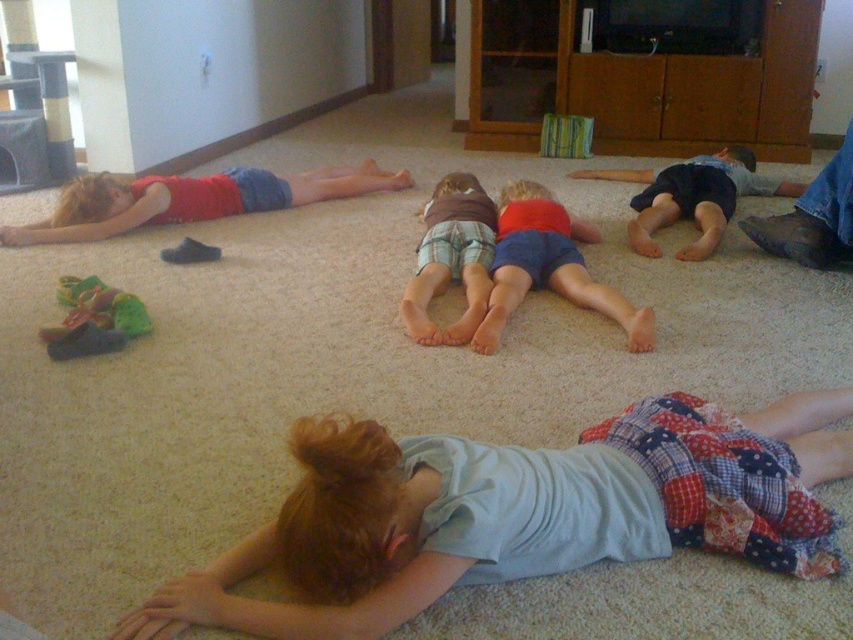
You are a child looking for your shorts. You see the red cotton shorts at center and the rubberized green and brown toy at lower left. Which direction should you move to reach your shorts?

You should move to the right to reach the red cotton shorts at center since it is located to the right of the rubberized green and brown toy at lower left.

You are a photographer standing in the room and want to take a photo of the red cotton shorts at center. Where should you position yourself to capture the shorts in the frame?

To capture the red cotton shorts at center in the frame, position yourself directly in front of the shorts at the coordinates point (548, 266).